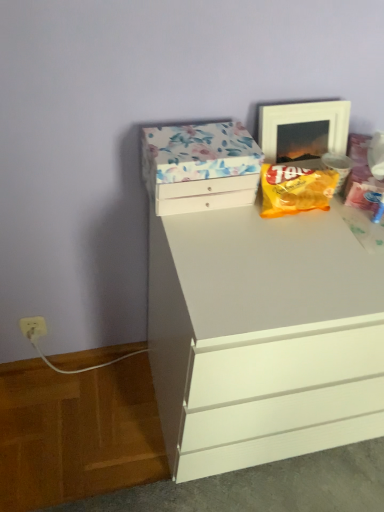
Question: Is white plastic electric outlet at lower left turned away from white glossy picture frame at upper right?

Choices:
 (A) no
 (B) yes

Answer: (A)

Question: Does white plastic electric outlet at lower left have a greater width compared to white glossy picture frame at upper right?

Choices:
 (A) no
 (B) yes

Answer: (A)

Question: From a real-world perspective, does white plastic electric outlet at lower left sit lower than white glossy picture frame at upper right?

Choices:
 (A) yes
 (B) no

Answer: (A)

Question: Does white plastic electric outlet at lower left appear on the left side of white glossy picture frame at upper right?

Choices:
 (A) no
 (B) yes

Answer: (B)

Question: Does white plastic electric outlet at lower left have a smaller size compared to white glossy picture frame at upper right?

Choices:
 (A) no
 (B) yes

Answer: (B)

Question: Considering the relative positions of white plastic electric outlet at lower left and white glossy picture frame at upper right in the image provided, is white plastic electric outlet at lower left in front of white glossy picture frame at upper right?

Choices:
 (A) yes
 (B) no

Answer: (B)

Question: Are floral paper-covered box at upper center and white matte chest of drawers at center far apart?

Choices:
 (A) yes
 (B) no

Answer: (B)

Question: From a real-world perspective, is floral paper-covered box at upper center physically below white matte chest of drawers at center?

Choices:
 (A) yes
 (B) no

Answer: (B)

Question: Is floral paper-covered box at upper center wider than white matte chest of drawers at center?

Choices:
 (A) yes
 (B) no

Answer: (B)

Question: Could you tell me if floral paper-covered box at upper center is facing white matte chest of drawers at center?

Choices:
 (A) yes
 (B) no

Answer: (B)

Question: From a real-world perspective, is floral paper-covered box at upper center located higher than white matte chest of drawers at center?

Choices:
 (A) no
 (B) yes

Answer: (B)

Question: Is floral paper-covered box at upper center to the right of white matte chest of drawers at center from the viewer's perspective?

Choices:
 (A) yes
 (B) no

Answer: (B)

Question: Considering the relative sizes of floral paper-covered box at upper center and yellow matte snack packet at upper right in the image provided, is floral paper-covered box at upper center shorter than yellow matte snack packet at upper right?

Choices:
 (A) yes
 (B) no

Answer: (B)